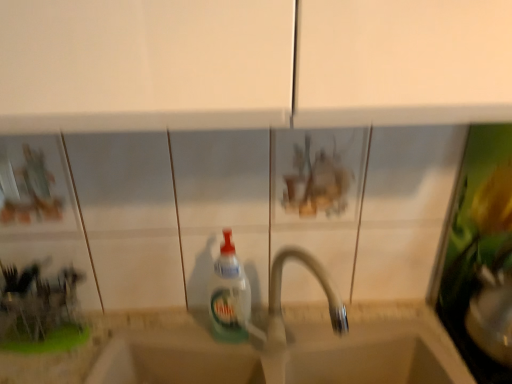
The width and height of the screenshot is (512, 384). Find the location of `beige stone sink at center`. beige stone sink at center is located at coordinates (286, 350).

How different are the orientations of translucent plastic bottle at center and white plastic tap at center in degrees?

41.2 degrees.

Considering the positions of objects translucent plastic bottle at center and white plastic tap at center in the image provided, who is more to the left, translucent plastic bottle at center or white plastic tap at center?

From the viewer's perspective, translucent plastic bottle at center appears more on the left side.

Is translucent plastic bottle at center oriented towards white plastic tap at center?

No, translucent plastic bottle at center is not facing towards white plastic tap at center.

Consider the image. Considering the sizes of objects translucent plastic bottle at center and white plastic tap at center in the image provided, who is shorter, translucent plastic bottle at center or white plastic tap at center?

translucent plastic bottle at center is shorter.

Would you say white plastic tap at center is part of beige stone sink at center's contents?

No, white plastic tap at center is not inside beige stone sink at center.

Consider the image. Between beige stone sink at center and white plastic tap at center, which one appears on the left side from the viewer's perspective?

beige stone sink at center is more to the left.

Which object is thinner, beige stone sink at center or white plastic tap at center?

Thinner between the two is beige stone sink at center.

Are beige stone sink at center and white plastic tap at center located far from each other?

No, beige stone sink at center is not far from white plastic tap at center.

Between white plastic tap at center and beige stone sink at center, which one is positioned behind?

Positioned behind is beige stone sink at center.

In the scene shown: Is white plastic tap at center taller than beige stone sink at center?

Yes, white plastic tap at center is taller than beige stone sink at center.

Can you tell me how much white plastic tap at center and beige stone sink at center differ in facing direction?

The angle between the facing direction of white plastic tap at center and the facing direction of beige stone sink at center is 40.4 degrees.

Which object is thinner, white plastic tap at center or beige stone sink at center?

With smaller width is beige stone sink at center.

Is white plastic tap at center facing towards translucent plastic bottle at center?

No, white plastic tap at center is not aimed at translucent plastic bottle at center.

In the image, is white plastic tap at center positioned in front of or behind translucent plastic bottle at center?

white plastic tap at center is positioned closer to the viewer than translucent plastic bottle at center.

Considering the sizes of objects white plastic tap at center and translucent plastic bottle at center in the image provided, who is taller, white plastic tap at center or translucent plastic bottle at center?

Standing taller between the two is white plastic tap at center.

Considering the relative sizes of beige stone sink at center and translucent plastic bottle at center in the image provided, is beige stone sink at center shorter than translucent plastic bottle at center?

No.

Is point (112, 338) farther from viewer compared to point (237, 281)?

Yes, it is.

Is the position of beige stone sink at center less distant than that of translucent plastic bottle at center?

No, beige stone sink at center is further to the viewer.

Is beige stone sink at center far away from translucent plastic bottle at center?

They are positioned close to each other.

Does translucent plastic bottle at center touch beige stone sink at center?

No, translucent plastic bottle at center is not in contact with beige stone sink at center.

From a real-world perspective, is translucent plastic bottle at center positioned under beige stone sink at center based on gravity?

No, from a real-world perspective, translucent plastic bottle at center is not beneath beige stone sink at center.

From the picture: Which of these two, translucent plastic bottle at center or beige stone sink at center, is smaller?

Smaller between the two is translucent plastic bottle at center.

The height and width of the screenshot is (384, 512). Find the location of `bottle that is on the left side of white plastic tap at center`. bottle that is on the left side of white plastic tap at center is located at coordinates (229, 294).

The width and height of the screenshot is (512, 384). I want to click on tap above the beige stone sink at center (from the image's perspective), so click(281, 312).

Considering their positions, is translucent plastic bottle at center positioned closer to beige stone sink at center than white plastic tap at center?

white plastic tap at center.

Based on their spatial positions, is white plastic tap at center or translucent plastic bottle at center closer to beige stone sink at center?

white plastic tap at center.

Looking at the image, which one is located closer to white plastic tap at center, translucent plastic bottle at center or beige stone sink at center?

The object closer to white plastic tap at center is translucent plastic bottle at center.

Based on their spatial positions, is beige stone sink at center or white plastic tap at center further from translucent plastic bottle at center?

beige stone sink at center lies further to translucent plastic bottle at center than the other object.

Which object lies further to the anchor point white plastic tap at center, beige stone sink at center or translucent plastic bottle at center?

The object further to white plastic tap at center is beige stone sink at center.

Estimate the real-world distances between objects in this image. Which object is closer to translucent plastic bottle at center, white plastic tap at center or beige stone sink at center?

The object closer to translucent plastic bottle at center is white plastic tap at center.

Locate an element on the screen. This screenshot has width=512, height=384. tap between translucent plastic bottle at center and beige stone sink at center in the up-down direction is located at coordinates (281, 312).